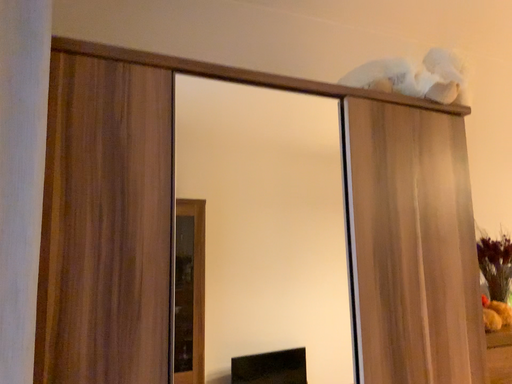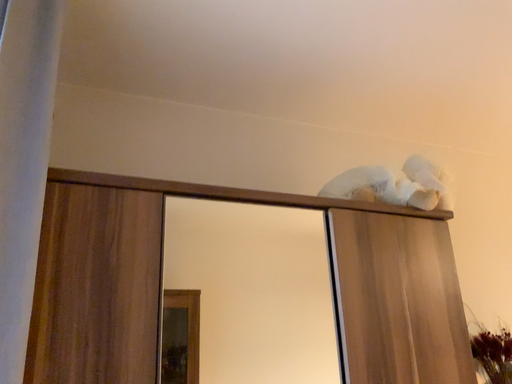
Question: How did the camera likely rotate when shooting the video?

Choices:
 (A) rotated downward
 (B) rotated upward

Answer: (B)